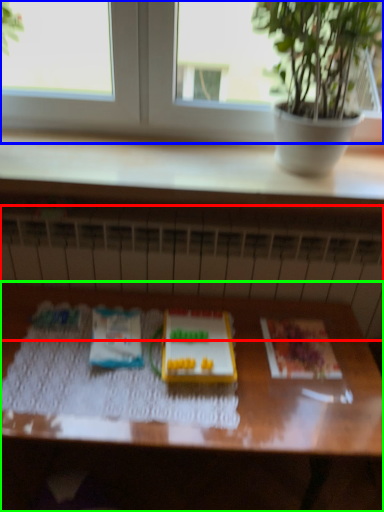
Question: Based on their relative distances, which object is nearer to radiator (highlighted by a red box)? Choose from window (highlighted by a blue box) and table (highlighted by a green box).

Choices:
 (A) window
 (B) table

Answer: (B)